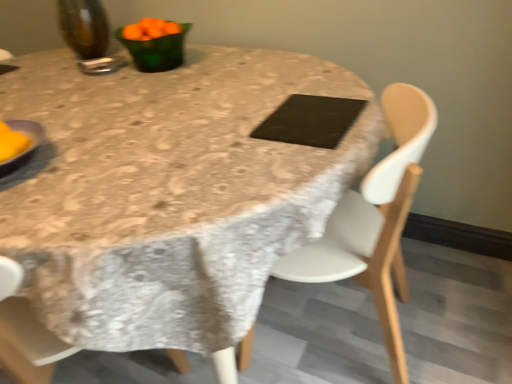
Where is `free region on the left part of black matte pad at center`? free region on the left part of black matte pad at center is located at coordinates coord(242,126).